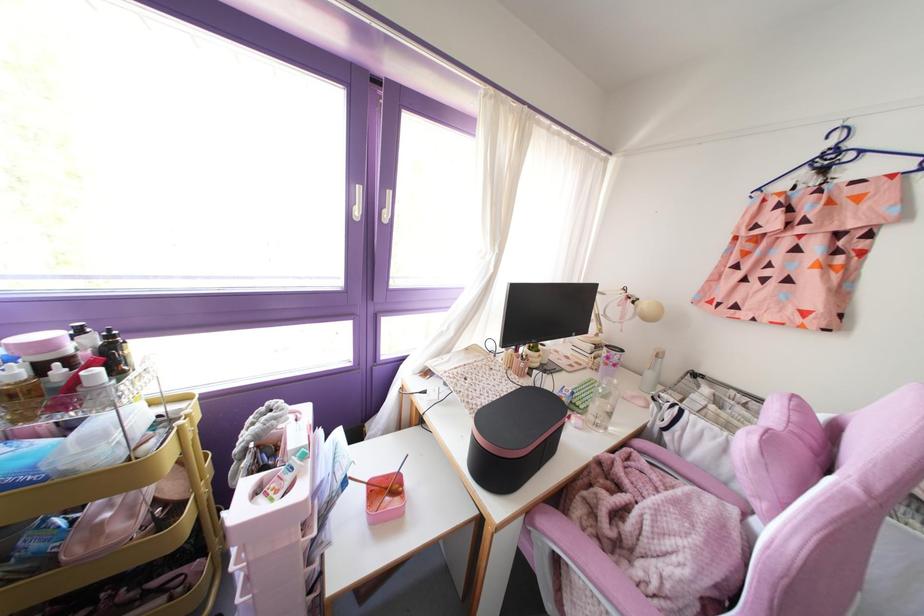
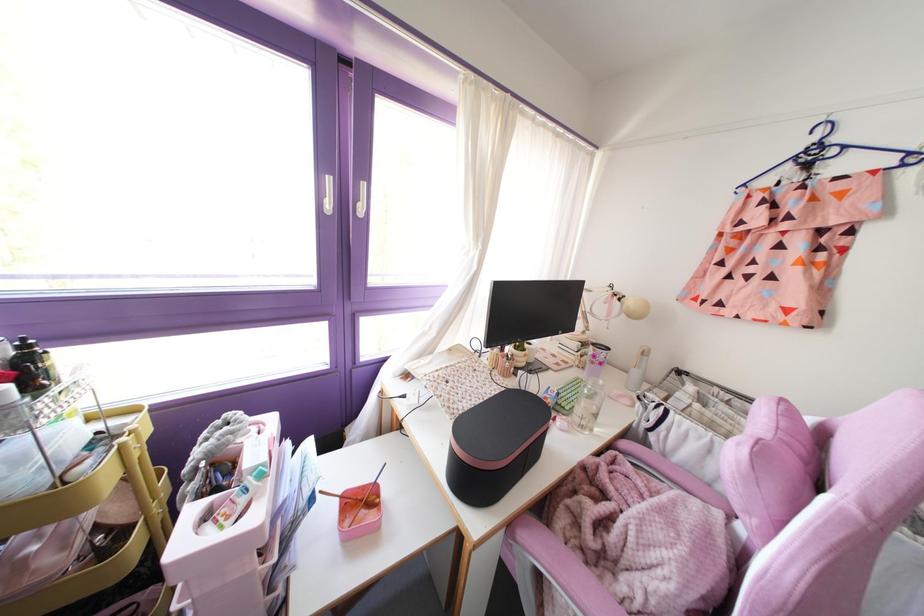
The point at (357, 212) is marked in the first image. Where is the corresponding point in the second image?

(329, 205)